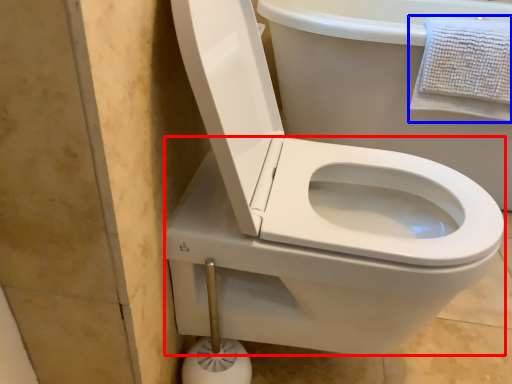
Question: Which object is closer to the camera taking this photo, bidet (highlighted by a red box) or bath towel (highlighted by a blue box)?

Choices:
 (A) bidet
 (B) bath towel

Answer: (A)